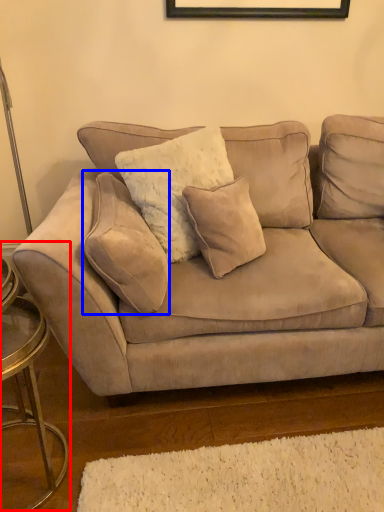
Question: Which object is further to the camera taking this photo, side table (highlighted by a red box) or pillow (highlighted by a blue box)?

Choices:
 (A) side table
 (B) pillow

Answer: (B)